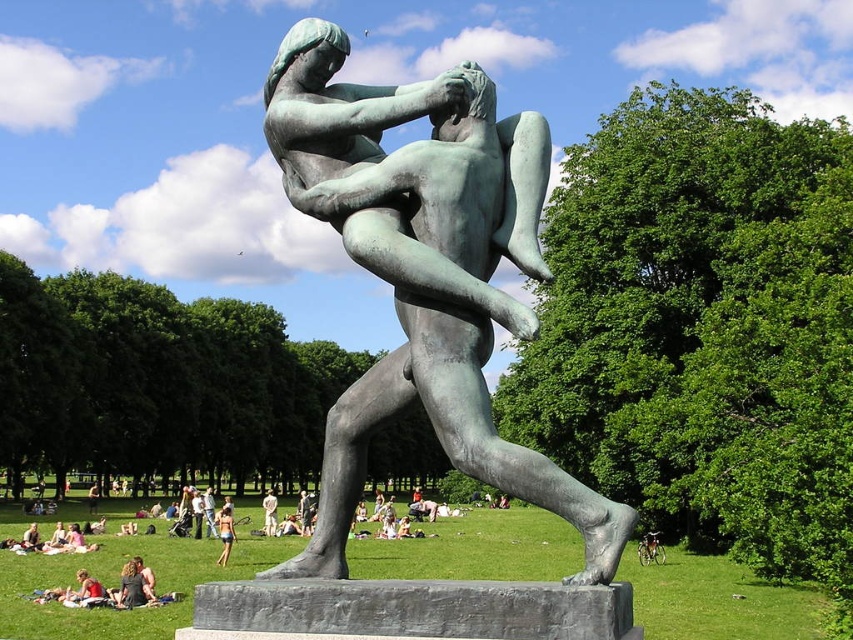
You are a GUI agent. You are given a task and a screenshot of the screen. Output one action in this format:
    pyautogui.click(x=<x>, y=<y>)
    Task: Click on the matte black dress at lower left
    The image size is (853, 640).
    Given the screenshot: What is the action you would take?
    pyautogui.click(x=132, y=586)

Is matte black dress at lower left wider than matte bronze statue at center?

No, matte black dress at lower left is not wider than matte bronze statue at center.

Between point (148, 595) and point (202, 497), which one is positioned in front?

Point (148, 595) is in front.

The image size is (853, 640). Identify the location of matte black dress at lower left. click(x=132, y=586).

Between green patina bronze statue at center and light brown wood man at center, which one has less height?

Standing shorter between the two is green patina bronze statue at center.

Does green patina bronze statue at center have a greater height compared to light brown wood man at center?

In fact, green patina bronze statue at center may be shorter than light brown wood man at center.

Between point (323, 148) and point (274, 524), which one is positioned in front?

Point (323, 148)

Locate an element on the screen. This screenshot has height=640, width=853. green patina bronze statue at center is located at coordinates (424, 273).

Can you confirm if light brown hair at center is wider than matte bronze statue at center?

In fact, light brown hair at center might be narrower than matte bronze statue at center.

Is light brown hair at center below matte bronze statue at center?

No.

Which is behind, point (228, 525) or point (206, 516)?

The point (206, 516) is behind.

At what (x,y) coordinates should I click in order to perform the action: click on light brown hair at center. Please return your answer as a coordinate pair (x, y). Looking at the image, I should click on pyautogui.click(x=224, y=532).